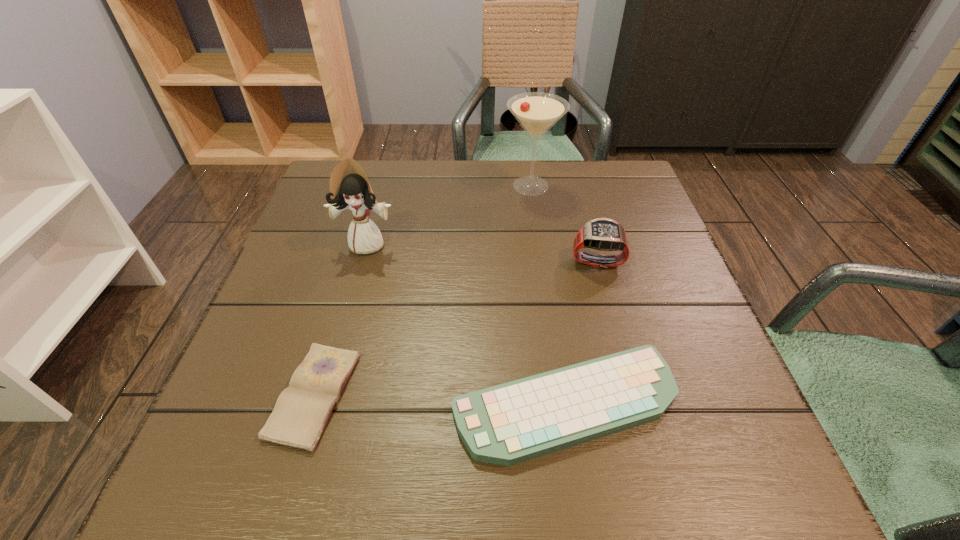
The height and width of the screenshot is (540, 960). I want to click on object present at the far edge, so click(x=537, y=112).

At what (x,y) coordinates should I click in order to perform the action: click on computer keyboard at the near edge. Please return your answer as a coordinate pair (x, y). Image resolution: width=960 pixels, height=540 pixels. Looking at the image, I should click on (507, 424).

You are a GUI agent. You are given a task and a screenshot of the screen. Output one action in this format:
    pyautogui.click(x=<x>, y=<y>)
    Task: Click on the diary present at the near edge
    
    Given the screenshot: What is the action you would take?
    (302, 410)

The width and height of the screenshot is (960, 540). Find the location of `doll that is at the left edge`. doll that is at the left edge is located at coordinates [x=349, y=187].

This screenshot has width=960, height=540. I want to click on diary that is at the left edge, so click(302, 410).

The image size is (960, 540). In order to click on watch positioned at the right edge in this screenshot , I will do `click(604, 234)`.

At what (x,y) coordinates should I click in order to perform the action: click on computer keyboard situated at the right edge. Please return your answer as a coordinate pair (x, y). Looking at the image, I should click on (507, 424).

Where is `object at the near left corner`? This screenshot has width=960, height=540. object at the near left corner is located at coordinates (302, 410).

I want to click on object present at the near right corner, so click(507, 424).

Where is `free space at the far edge of the desktop`? This screenshot has width=960, height=540. free space at the far edge of the desktop is located at coordinates (496, 188).